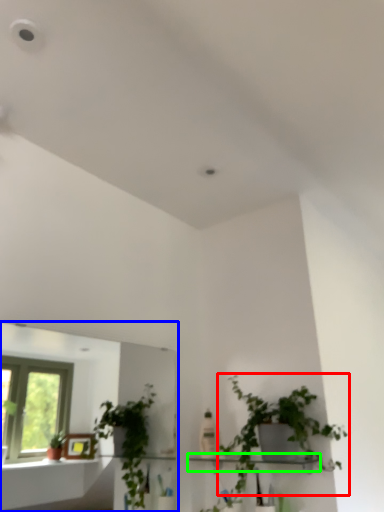
Question: Considering the real-world distances, which object is farthest from houseplant (highlighted by a red box)? mirror (highlighted by a blue box) or shelf (highlighted by a green box)?

Choices:
 (A) mirror
 (B) shelf

Answer: (A)